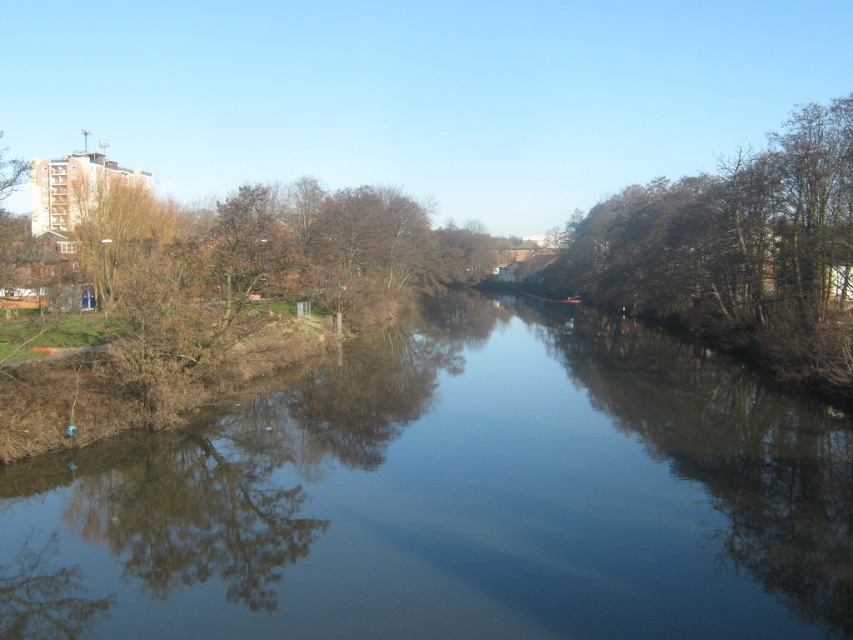
You are a photographer standing on the riverbank and want to capture both the transparent water at center and the brown leafy tree at right in your shot. Which object will appear taller in the photograph?

The brown leafy tree at right will appear taller in the photograph because the transparent water at center is not as tall as the brown leafy tree at right.

You are standing at the point labeled as point (453, 499) in the river scene. Can you see the tall residential building mentioned in the scene description through the transparent water at center?

The point (453, 499) is on transparent water at center, so yes, you can see the tall residential building through the transparent water at center.